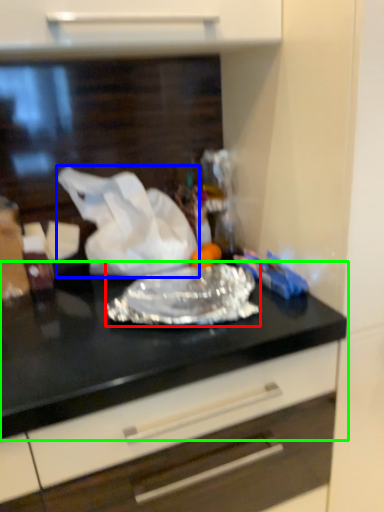
Question: Based on their relative distances, which object is farther from wrap (highlighted by a red box)? Choose from wrapping paper (highlighted by a blue box) and countertop (highlighted by a green box).

Choices:
 (A) wrapping paper
 (B) countertop

Answer: (A)